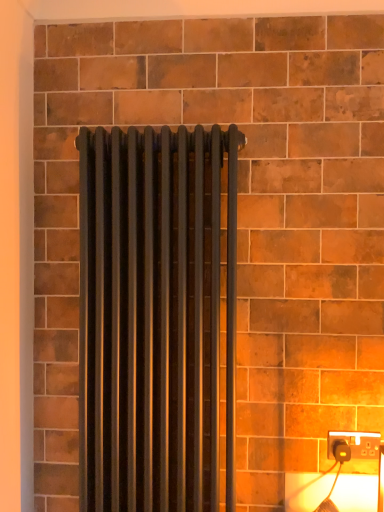
Question: Relative to matte black radiator at center, is black plastic power plug at lower right in front or behind?

Choices:
 (A) behind
 (B) front

Answer: (A)

Question: Is point (372, 437) closer or farther from the camera than point (142, 271)?

Choices:
 (A) farther
 (B) closer

Answer: (A)

Question: Visually, is black plastic power plug at lower right positioned to the left or to the right of matte black radiator at center?

Choices:
 (A) right
 (B) left

Answer: (A)

Question: Is matte black radiator at center situated inside black plastic power plug at lower right or outside?

Choices:
 (A) outside
 (B) inside

Answer: (A)

Question: Relative to black plastic power plug at lower right, is matte black radiator at center in front or behind?

Choices:
 (A) front
 (B) behind

Answer: (A)

Question: Visually, is matte black radiator at center positioned to the left or to the right of black plastic power plug at lower right?

Choices:
 (A) right
 (B) left

Answer: (B)

Question: From the image's perspective, is matte black radiator at center above or below black plastic power plug at lower right?

Choices:
 (A) above
 (B) below

Answer: (A)